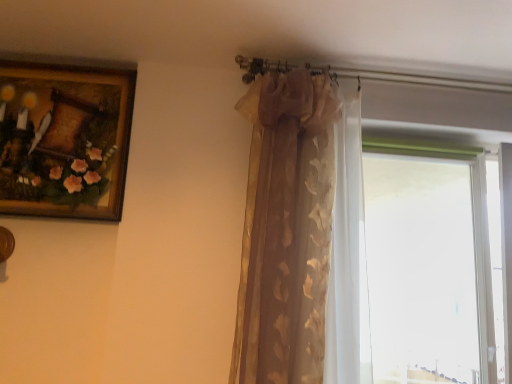
Question: Could you tell me if gold textured curtain at upper center is turned towards wooden framed painting at upper left?

Choices:
 (A) no
 (B) yes

Answer: (A)

Question: Is gold textured curtain at upper center placed right next to wooden framed painting at upper left?

Choices:
 (A) no
 (B) yes

Answer: (A)

Question: Can you confirm if gold textured curtain at upper center is positioned to the left of wooden framed painting at upper left?

Choices:
 (A) yes
 (B) no

Answer: (B)

Question: Is gold textured curtain at upper center outside wooden framed painting at upper left?

Choices:
 (A) yes
 (B) no

Answer: (A)

Question: Is gold textured curtain at upper center at the right side of wooden framed painting at upper left?

Choices:
 (A) no
 (B) yes

Answer: (B)

Question: Considering the positions of gold textured curtain at upper center and wooden framed painting at upper left in the image, is gold textured curtain at upper center taller or shorter than wooden framed painting at upper left?

Choices:
 (A) tall
 (B) short

Answer: (A)

Question: Based on their sizes in the image, would you say gold textured curtain at upper center is bigger or smaller than wooden framed painting at upper left?

Choices:
 (A) big
 (B) small

Answer: (A)

Question: From a real-world perspective, is gold textured curtain at upper center positioned above or below wooden framed painting at upper left?

Choices:
 (A) below
 (B) above

Answer: (A)

Question: From the image's perspective, is gold textured curtain at upper center above or below wooden framed painting at upper left?

Choices:
 (A) below
 (B) above

Answer: (A)

Question: Looking at the image, does wooden framed painting at upper left seem bigger or smaller compared to gold textured curtain at upper center?

Choices:
 (A) small
 (B) big

Answer: (A)

Question: Is wooden framed painting at upper left wider or thinner than gold textured curtain at upper center?

Choices:
 (A) thin
 (B) wide

Answer: (A)

Question: From a real-world perspective, is wooden framed painting at upper left physically located above or below gold textured curtain at upper center?

Choices:
 (A) above
 (B) below

Answer: (A)

Question: Is wooden framed painting at upper left spatially inside gold textured curtain at upper center, or outside of it?

Choices:
 (A) inside
 (B) outside

Answer: (B)

Question: Relative to transparent glass window at right, is gold textured curtain at upper center in front or behind?

Choices:
 (A) front
 (B) behind

Answer: (A)

Question: In terms of size, does gold textured curtain at upper center appear bigger or smaller than transparent glass window at right?

Choices:
 (A) small
 (B) big

Answer: (B)